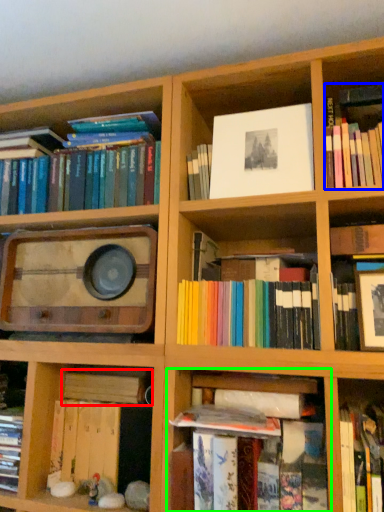
Question: Considering the real-world distances, which object is farthest from book (highlighted by a red box)? book (highlighted by a blue box) or shelf (highlighted by a green box)?

Choices:
 (A) book
 (B) shelf

Answer: (A)